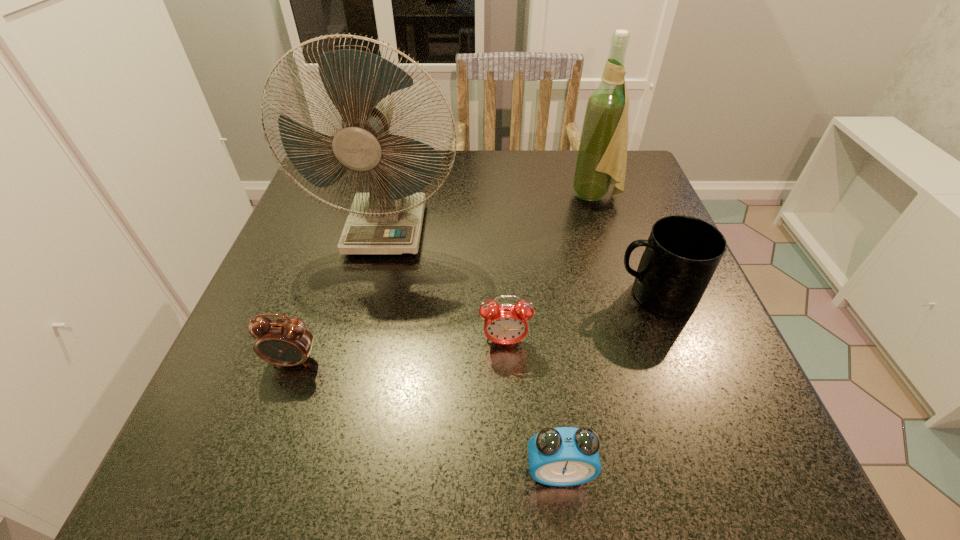
What are the coordinates of `fan positioned at the left edge` in the screenshot? It's located at (388, 220).

Find the location of a particular element. This screenshot has width=960, height=540. alarm clock at the left edge is located at coordinates (287, 342).

At what (x,y) coordinates should I click in order to perform the action: click on wine bottle at the right edge. Please return your answer as a coordinate pair (x, y). This screenshot has height=540, width=960. Looking at the image, I should click on (602, 154).

What are the coordinates of `mug located at the right edge` in the screenshot? It's located at (682, 253).

You are a GUI agent. You are given a task and a screenshot of the screen. Output one action in this format:
    pyautogui.click(x=<x>, y=<y>)
    Task: Click on the object at the far left corner
    
    Given the screenshot: What is the action you would take?
    pyautogui.click(x=388, y=220)

The image size is (960, 540). I want to click on object that is at the far right corner, so click(602, 154).

This screenshot has height=540, width=960. Identify the location of blank space at the far edge. (573, 168).

This screenshot has height=540, width=960. In the image, there is a desktop. In order to click on vacant region at the left edge in this screenshot , I will do `click(327, 293)`.

In the image, there is a desktop. Where is `vacant space at the near right corner`? vacant space at the near right corner is located at coordinates (700, 449).

Identify the location of free space between the wine bottle and the third farthest object. (625, 246).